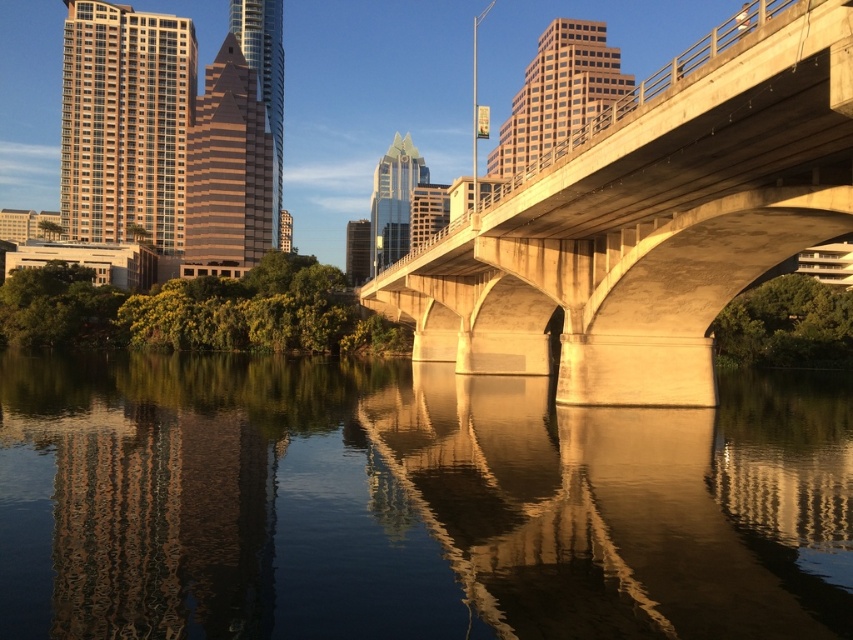
You are a city planner assessing the urban layout. Given the smooth water at center and the concrete bridge at center, which one appears to be taller from your viewpoint?

The concrete bridge at center is taller than the smooth water at center, so the concrete bridge at center appears taller from your viewpoint.

Consider the image. You are a city planner assessing the distance between the smooth water at center and the concrete bridge at center for a new public art installation. Given that the minimum required distance for safety regulations is 40 feet, can the installation be placed between them?

The smooth water at center and concrete bridge at center are 40.50 feet apart, which exceeds the 40 feet safety requirement. Therefore, the installation can be placed between them as the distance is sufficient.

You are a city planner evaluating the image of the urban landscape. You need to determine if the smooth water at center can accommodate a new boat that is 10 meters wide. The concrete bridge at center has a clearance of 8 meters. Can the boat pass under the bridge? Please consider both the width of the water and the bridge.

The smooth water at center might be wider than the concrete bridge at center, but the boat cannot pass under the bridge because the bridge has a clearance of 8 meters, which is less than the boat width of 10 meters. The width of the water is not the limiting factor here as the bridge is narrower than the boat.